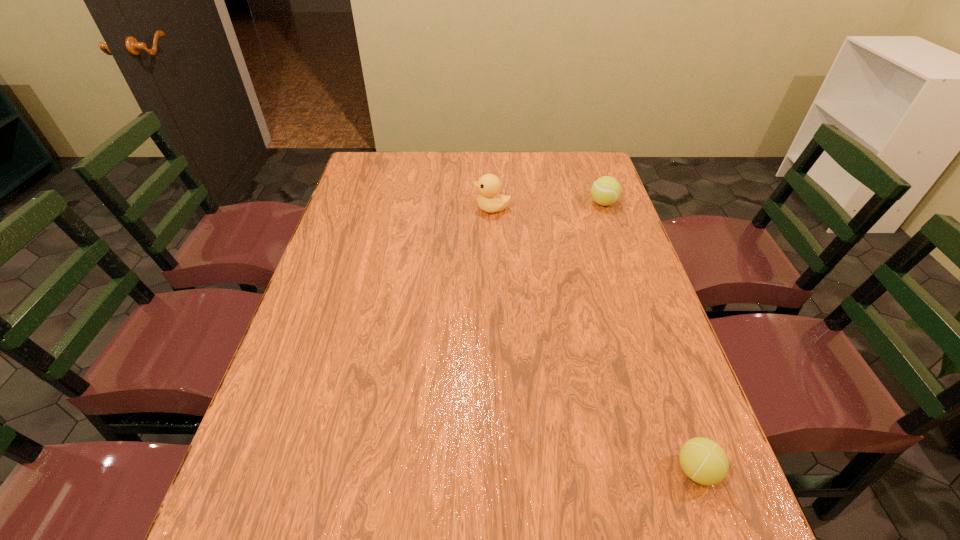
At what (x,y) coordinates should I click in order to perform the action: click on free space between the leftmost object and the nearest object. Please return your answer as a coordinate pair (x, y). This screenshot has height=540, width=960. Looking at the image, I should click on (594, 339).

At what (x,y) coordinates should I click in order to perform the action: click on vacant space that's between the farther tennis ball and the shorter tennis ball. Please return your answer as a coordinate pair (x, y). Image resolution: width=960 pixels, height=540 pixels. Looking at the image, I should click on (650, 336).

Locate an element on the screen. The width and height of the screenshot is (960, 540). vacant area between the taller tennis ball and the nearest object is located at coordinates (650, 336).

Image resolution: width=960 pixels, height=540 pixels. In order to click on free point between the shortest object and the tallest object in this screenshot , I will do `click(594, 339)`.

Find the location of a particular element. The image size is (960, 540). vacant area that lies between the second shortest object and the shorter tennis ball is located at coordinates (650, 336).

Identify which object is the second nearest to the shortest object. Please provide its 2D coordinates. Your answer should be formatted as a tuple, i.e. [(x, y)], where the tuple contains the x and y coordinates of a point satisfying the conditions above.

[(489, 185)]

Choose which object is the nearest neighbor to the tallest object. Please provide its 2D coordinates. Your answer should be formatted as a tuple, i.e. [(x, y)], where the tuple contains the x and y coordinates of a point satisfying the conditions above.

[(606, 190)]

This screenshot has width=960, height=540. I want to click on free point that satisfies the following two spatial constraints: 1. on the face of the nearest object; 2. on the left side of the leftmost object, so click(500, 470).

Image resolution: width=960 pixels, height=540 pixels. Find the location of `vacant space that satisfies the following two spatial constraints: 1. on the face of the shorter tennis ball; 2. on the left side of the duck`. vacant space that satisfies the following two spatial constraints: 1. on the face of the shorter tennis ball; 2. on the left side of the duck is located at coordinates (500, 470).

Where is `blank space that satisfies the following two spatial constraints: 1. on the back side of the nearest object; 2. on the face of the leftmost object`? The height and width of the screenshot is (540, 960). blank space that satisfies the following two spatial constraints: 1. on the back side of the nearest object; 2. on the face of the leftmost object is located at coordinates (605, 208).